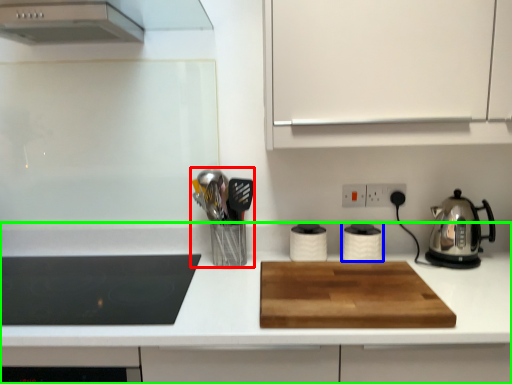
Question: Which object is the farthest from appliance (highlighted by a red box)? Choose among these: kitchen appliance (highlighted by a blue box) or countertop (highlighted by a green box).

Choices:
 (A) kitchen appliance
 (B) countertop

Answer: (A)